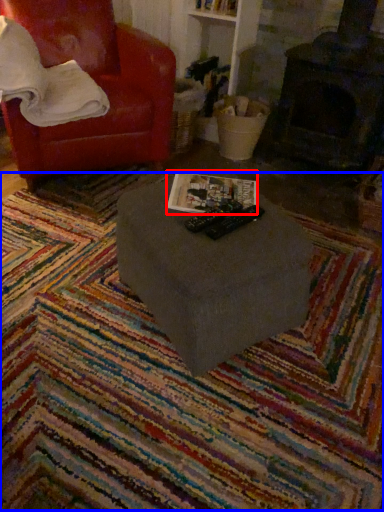
Question: Among these objects, which one is farthest to the camera, magazine (highlighted by a red box) or mat (highlighted by a blue box)?

Choices:
 (A) magazine
 (B) mat

Answer: (A)